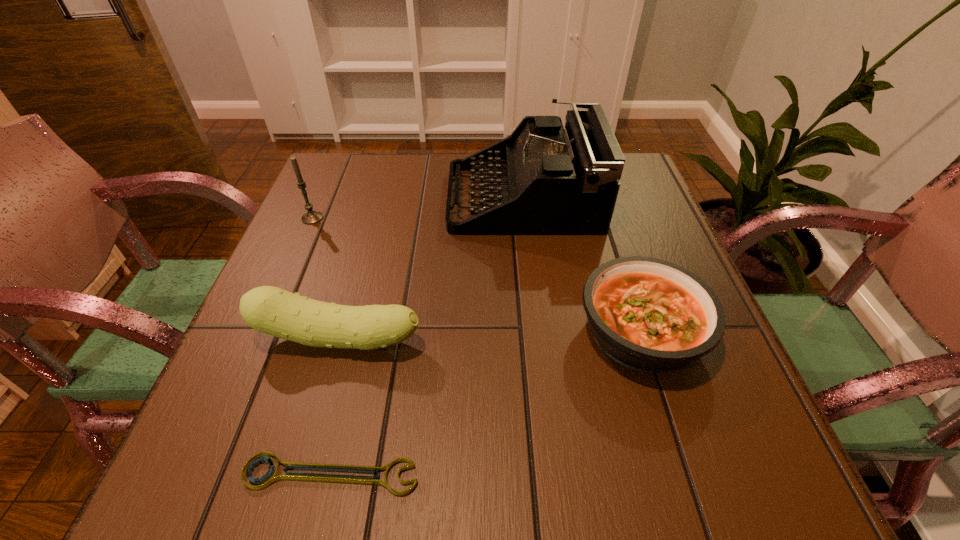
You are a GUI agent. You are given a task and a screenshot of the screen. Output one action in this format:
    pyautogui.click(x=<x>, y=<y>)
    Task: Click on the free spot between the third shortest object and the candle
    The width and height of the screenshot is (960, 540).
    Given the screenshot: What is the action you would take?
    pyautogui.click(x=325, y=278)

Image resolution: width=960 pixels, height=540 pixels. In order to click on free space that is in between the third shortest object and the candle in this screenshot , I will do `click(325, 278)`.

You are a GUI agent. You are given a task and a screenshot of the screen. Output one action in this format:
    pyautogui.click(x=<x>, y=<y>)
    Task: Click on the free space between the nearest object and the third tallest object
    The width and height of the screenshot is (960, 540).
    Given the screenshot: What is the action you would take?
    pyautogui.click(x=335, y=407)

You are a GUI agent. You are given a task and a screenshot of the screen. Output one action in this format:
    pyautogui.click(x=<x>, y=<y>)
    Task: Click on the vacant area that lies between the fourth tallest object and the candle
    Image resolution: width=960 pixels, height=540 pixels.
    Given the screenshot: What is the action you would take?
    pyautogui.click(x=477, y=275)

Locate an element on the screen. free spot between the typewriter and the second shortest object is located at coordinates (582, 265).

The width and height of the screenshot is (960, 540). Find the location of `free space between the candle and the stew`. free space between the candle and the stew is located at coordinates (477, 275).

Find the location of a particular element. free space that is in between the cucumber and the shortest object is located at coordinates (335, 407).

Find the location of `free space between the stew and the third tallest object`. free space between the stew and the third tallest object is located at coordinates (490, 335).

Choose which object is the fourth nearest neighbor to the wrench. Please provide its 2D coordinates. Your answer should be formatted as a tuple, i.e. [(x, y)], where the tuple contains the x and y coordinates of a point satisfying the conditions above.

[(311, 217)]

Locate an element on the screen. The width and height of the screenshot is (960, 540). object that is the second closest to the typewriter is located at coordinates (271, 310).